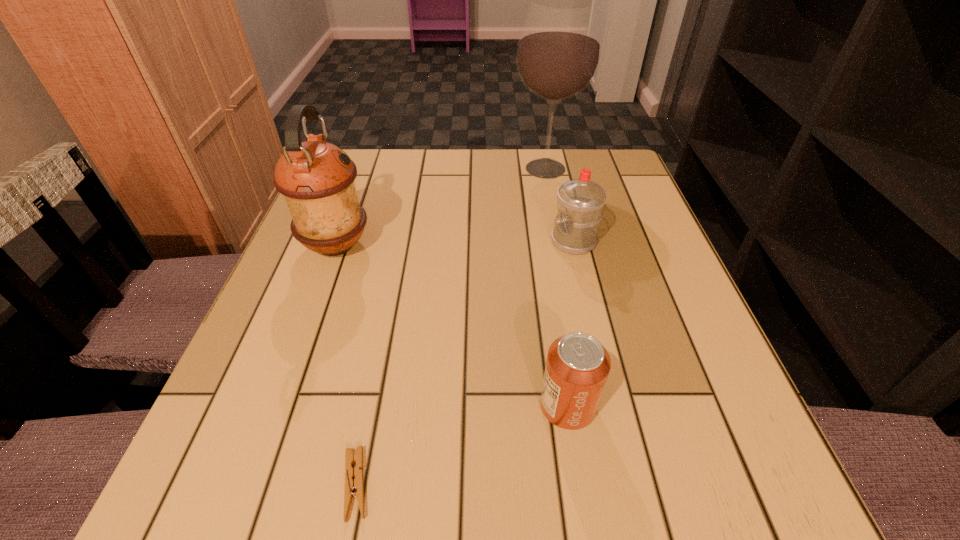
This screenshot has width=960, height=540. Identify the location of free space that satisfies the following two spatial constraints: 1. on the back side of the second nearest object; 2. on the right side of the clothespin. (371, 406).